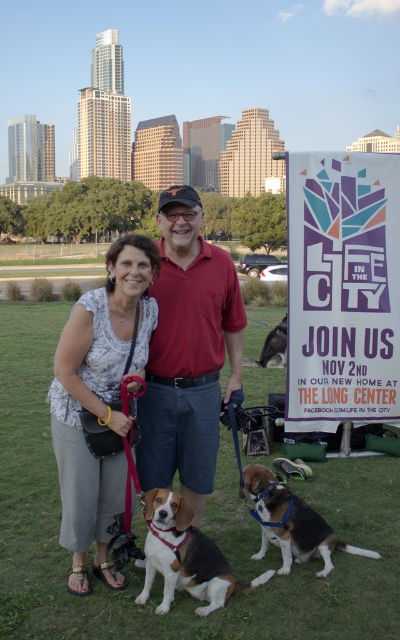
Question: Can you confirm if white printed blouse at center is positioned below brown and white fur dog at lower center?

Choices:
 (A) no
 (B) yes

Answer: (A)

Question: Does matte red shirt at center have a larger size compared to white printed blouse at center?

Choices:
 (A) yes
 (B) no

Answer: (B)

Question: Which object is closer to the camera taking this photo?

Choices:
 (A) white printed blouse at center
 (B) matte red shirt at center
 (C) brown and white fur dog at lower center
 (D) brown fur dog at center

Answer: (C)

Question: Estimate the real-world distances between objects in this image. Which object is farther from the white printed blouse at center?

Choices:
 (A) tri-colored fur dog at center
 (B) brown fur dog at center
 (C) brown and white fur dog at lower center
 (D) matte red shirt at center

Answer: (B)

Question: Is matte red shirt at center below brown and white fur dog at lower center?

Choices:
 (A) yes
 (B) no

Answer: (B)

Question: Which object appears farthest from the camera in this image?

Choices:
 (A) brown fur dog at center
 (B) white printed blouse at center

Answer: (A)